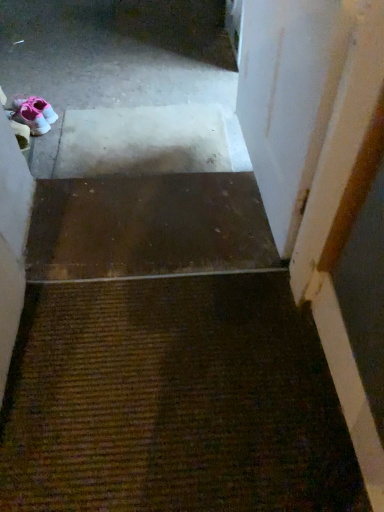
Locate an element on the screen. brown textured mat at center is located at coordinates (173, 401).

What are the coordinates of `pink fabric sneakers at upper left` in the screenshot? It's located at (34, 114).

Where is `brown matte stair at center`? The height and width of the screenshot is (512, 384). brown matte stair at center is located at coordinates (148, 227).

Consider the image. Does pink fabric sneakers at upper left have a smaller size compared to white matte door at upper right?

Indeed, pink fabric sneakers at upper left has a smaller size compared to white matte door at upper right.

How far apart are pink fabric sneakers at upper left and white matte door at upper right?

They are 1.29 meters apart.

Does pink fabric sneakers at upper left have a lesser height compared to white matte door at upper right?

Yes, pink fabric sneakers at upper left is shorter than white matte door at upper right.

From the image's perspective, is pink fabric sneakers at upper left under white matte door at upper right?

Incorrect, from the image's perspective, pink fabric sneakers at upper left is higher than white matte door at upper right.

Is pink fabric sneakers at upper left next to brown matte stair at center?

No, pink fabric sneakers at upper left is not making contact with brown matte stair at center.

Which is closer to the camera, (42, 134) or (91, 252)?

Point (42, 134).

Is pink fabric sneakers at upper left aimed at brown matte stair at center?

No, pink fabric sneakers at upper left is not aimed at brown matte stair at center.

Locate an element on the screen. This screenshot has width=384, height=512. footwear behind the brown matte stair at center is located at coordinates (34, 114).

From a real-world perspective, who is located higher, pink fabric sneakers at upper left or brown textured mat at center?

brown textured mat at center.

Considering the relative sizes of pink fabric sneakers at upper left and brown textured mat at center in the image provided, is pink fabric sneakers at upper left smaller than brown textured mat at center?

Yes.

Does pink fabric sneakers at upper left have a lesser width compared to brown textured mat at center?

Yes.

Which is in front, point (83, 230) or point (19, 112)?

The point (83, 230) is closer.

Is brown matte stair at center oriented towards pink fabric sneakers at upper left?

No, brown matte stair at center does not turn towards pink fabric sneakers at upper left.

Do you think brown matte stair at center is within pink fabric sneakers at upper left, or outside of it?

brown matte stair at center cannot be found inside pink fabric sneakers at upper left.

Can you confirm if brown textured mat at center is positioned to the left of pink fabric sneakers at upper left?

Incorrect, brown textured mat at center is not on the left side of pink fabric sneakers at upper left.

From a real-world perspective, is brown textured mat at center physically above pink fabric sneakers at upper left?

Yes, from a real-world perspective, brown textured mat at center is on top of pink fabric sneakers at upper left.

Can you confirm if brown textured mat at center is wider than pink fabric sneakers at upper left?

Yes.

Does brown textured mat at center come behind pink fabric sneakers at upper left?

No, it is not.

Is point (276, 105) less distant than point (206, 184)?

That is True.

The width and height of the screenshot is (384, 512). Identify the location of door on the right of brown matte stair at center. (289, 98).

Is white matte door at upper right not near brown matte stair at center?

They are positioned close to each other.

Relative to brown matte stair at center, is white matte door at upper right in front or behind?

Clearly, white matte door at upper right is in front of brown matte stair at center.

In the image, is white matte door at upper right positioned in front of or behind pink fabric sneakers at upper left?

Visually, white matte door at upper right is located in front of pink fabric sneakers at upper left.

Considering the positions of points (276, 117) and (25, 106), is point (276, 117) farther from camera compared to point (25, 106)?

No, (276, 117) is in front of (25, 106).

Locate an element on the screen. The width and height of the screenshot is (384, 512). footwear on the left of white matte door at upper right is located at coordinates (34, 114).

At what (x,y) coordinates should I click in order to perform the action: click on stairs above the pink fabric sneakers at upper left (from a real-world perspective). Please return your answer as a coordinate pair (x, y). The image size is (384, 512). Looking at the image, I should click on (148, 227).

Looking at the image, which one is located closer to brown matte stair at center, pink fabric sneakers at upper left or brown textured mat at center?

brown textured mat at center is positioned closer to the anchor brown matte stair at center.

Which object lies nearer to the anchor point white matte door at upper right, brown textured mat at center or brown matte stair at center?

brown matte stair at center is positioned closer to the anchor white matte door at upper right.

Based on their spatial positions, is brown textured mat at center or brown matte stair at center further from pink fabric sneakers at upper left?

brown textured mat at center.

From the image, which object appears to be nearer to pink fabric sneakers at upper left, brown matte stair at center or brown textured mat at center?

Based on the image, brown matte stair at center appears to be nearer to pink fabric sneakers at upper left.

From the image, which object appears to be nearer to pink fabric sneakers at upper left, brown textured mat at center or white matte door at upper right?

Based on the image, white matte door at upper right appears to be nearer to pink fabric sneakers at upper left.

When comparing their distances from brown matte stair at center, does pink fabric sneakers at upper left or white matte door at upper right seem closer?

Based on the image, white matte door at upper right appears to be nearer to brown matte stair at center.

Which object lies nearer to the anchor point brown matte stair at center, brown textured mat at center or white matte door at upper right?

Based on the image, brown textured mat at center appears to be nearer to brown matte stair at center.

Based on their spatial positions, is pink fabric sneakers at upper left or brown matte stair at center further from brown textured mat at center?

Based on the image, pink fabric sneakers at upper left appears to be further to brown textured mat at center.

Identify the location of stairs positioned between white matte door at upper right and pink fabric sneakers at upper left from near to far. The height and width of the screenshot is (512, 384). (148, 227).

Where is `doormat between white matte door at upper right and pink fabric sneakers at upper left in the front-back direction`? The width and height of the screenshot is (384, 512). doormat between white matte door at upper right and pink fabric sneakers at upper left in the front-back direction is located at coordinates (173, 401).

Identify the location of stairs between brown textured mat at center and pink fabric sneakers at upper left along the z-axis. This screenshot has width=384, height=512. (148, 227).

You are a GUI agent. You are given a task and a screenshot of the screen. Output one action in this format:
    pyautogui.click(x=<x>, y=<y>)
    Task: Click on the stairs that lies between white matte door at upper right and brown textured mat at center from top to bottom
    This screenshot has height=512, width=384.
    Given the screenshot: What is the action you would take?
    pyautogui.click(x=148, y=227)